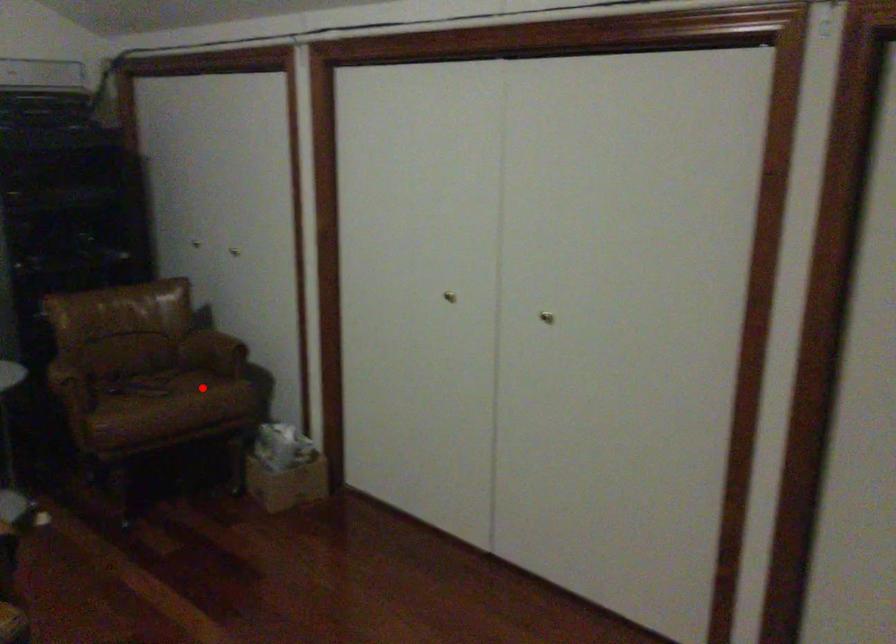
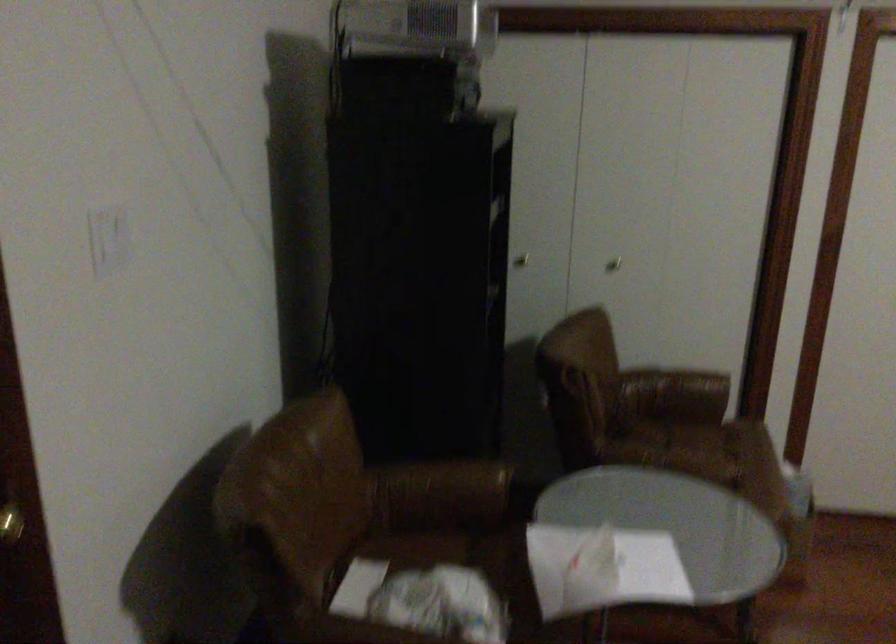
Question: I am providing you with two images of the same scene from different viewpoints. Image1 has a red point marked. In image2, the corresponding 3D location appears at what relative position? Reply with the corresponding letter.

Choices:
 (A) Closer
 (B) Farther

Answer: (A)